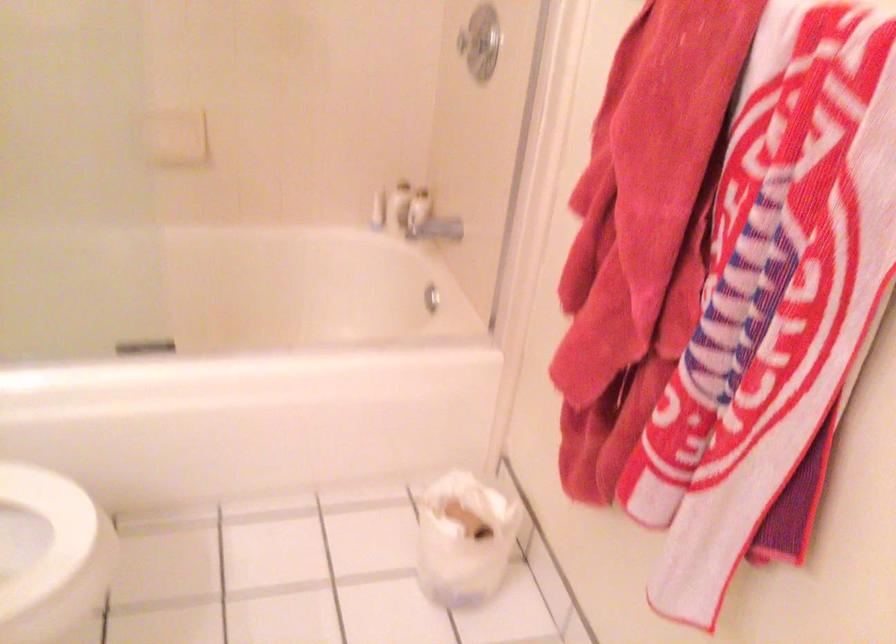
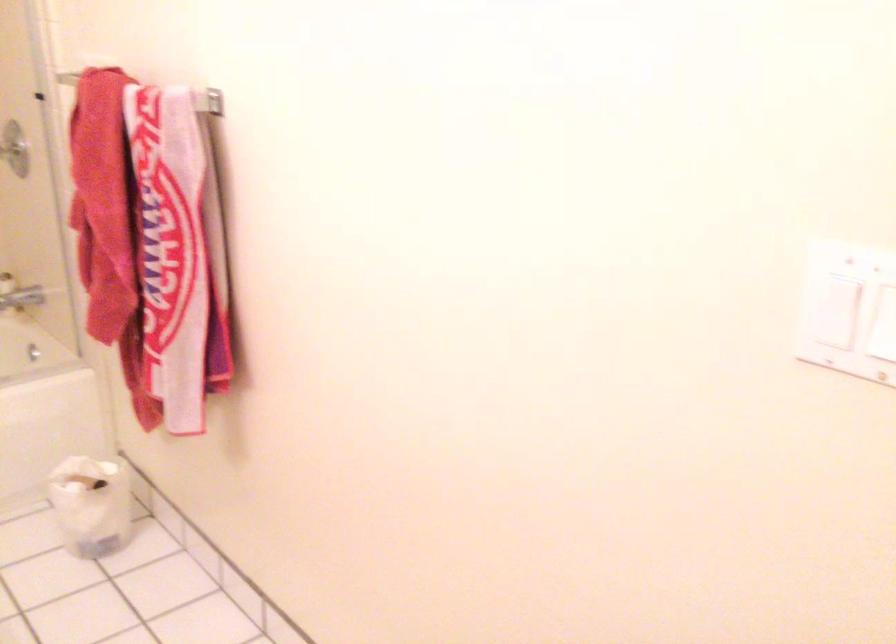
Question: Which direction would the cameraman need to move to produce the second image? Reply with the corresponding letter.

Choices:
 (A) Left
 (B) Right
 (C) Forward
 (D) Backward

Answer: (D)